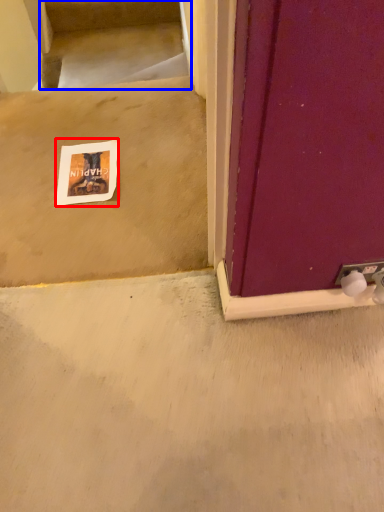
Question: Which point is further to the camera, postcard (highlighted by a red box) or stairwell (highlighted by a blue box)?

Choices:
 (A) postcard
 (B) stairwell

Answer: (B)